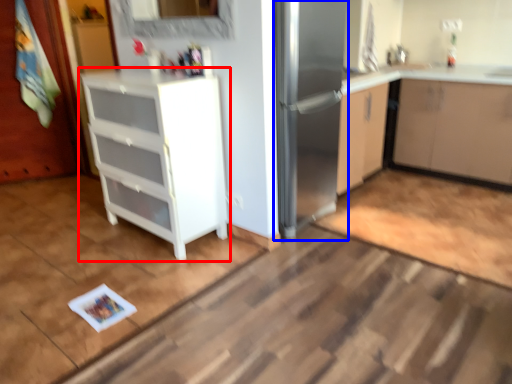
Question: Among these objects, which one is farthest to the camera, cabinetry (highlighted by a red box) or fridge (highlighted by a blue box)?

Choices:
 (A) cabinetry
 (B) fridge

Answer: (B)